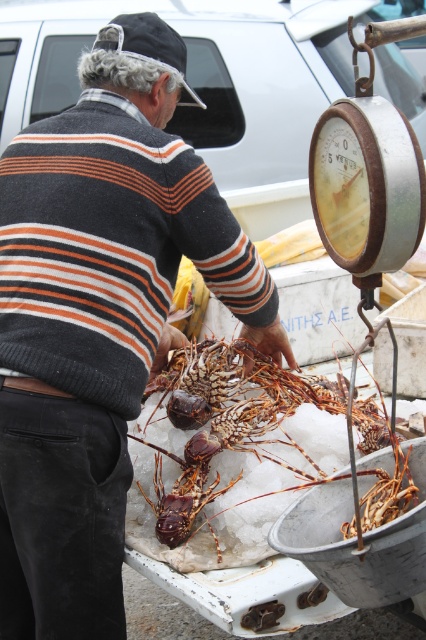
Question: Is striped sweater at center below shiny orange lobster at center?

Choices:
 (A) no
 (B) yes

Answer: (A)

Question: Which of the following is the farthest from the observer?

Choices:
 (A) shiny orange lobster at center
 (B) striped sweater at center

Answer: (A)

Question: Does striped sweater at center appear under shiny orange lobster at center?

Choices:
 (A) yes
 (B) no

Answer: (B)

Question: Among these objects, which one is nearest to the camera?

Choices:
 (A) shiny orange lobster at center
 (B) striped sweater at center

Answer: (B)

Question: Which of the following is the farthest from the observer?

Choices:
 (A) (189, 509)
 (B) (88, 236)

Answer: (A)

Question: Does striped sweater at center have a greater width compared to shiny orange lobster at center?

Choices:
 (A) no
 (B) yes

Answer: (A)